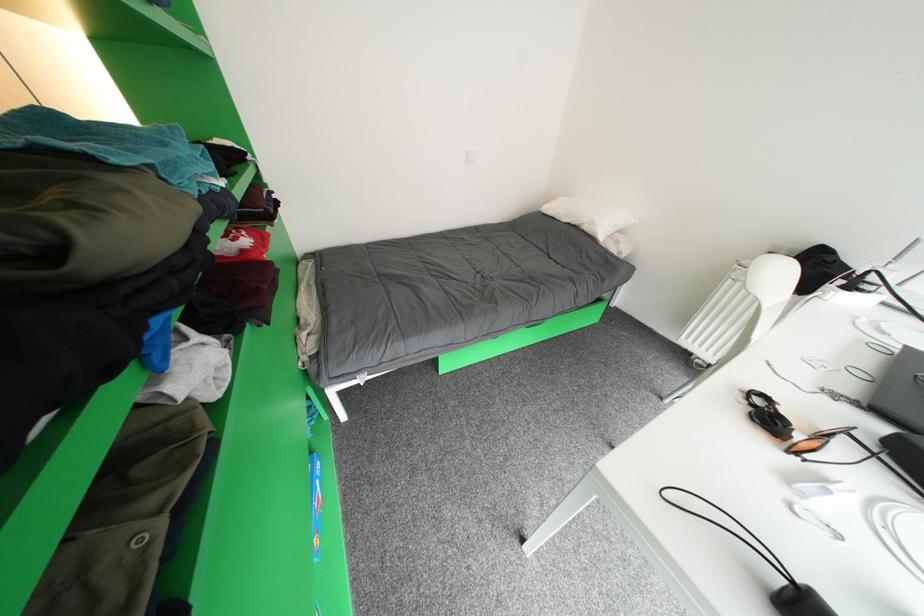
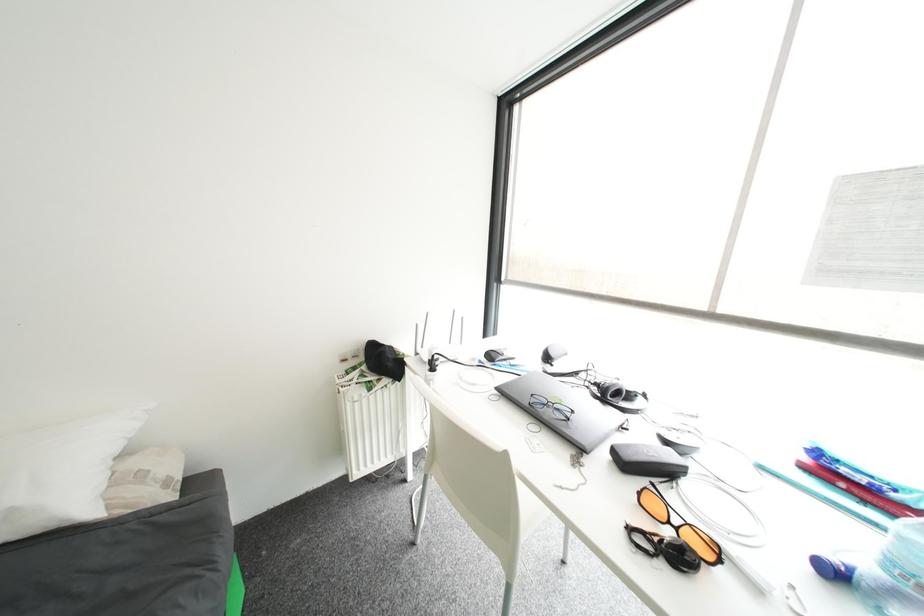
First-person continuous shooting, in which direction is the camera rotating?

The rotation direction of the camera is right-down.